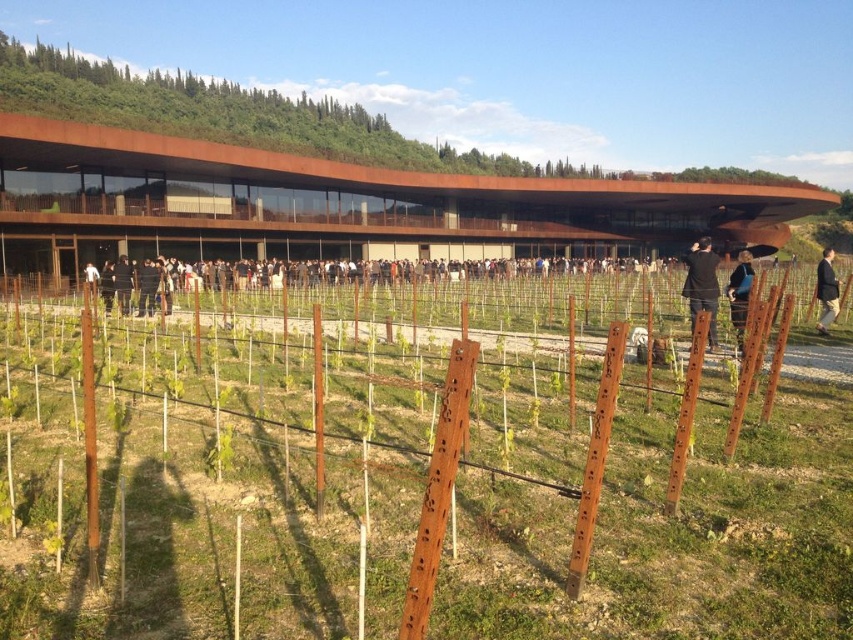
You are a landscape architect designing a new garden. You need to place a large sculpture that requires a space bigger than the rustic wood building at upper center. Can the black fabric at center accommodate it?

The rustic wood building at upper center is larger than the black fabric at center, so the black fabric at center cannot accommodate the sculpture since it is smaller.

You are an architect evaluating the placement of a new sculpture in the vineyard. The sculpture is exactly the same size as the black fabric jacket at lower right. If you want to place the sculpture near the rustic wood building at upper center, will the sculpture fit within the building width?

The rustic wood building at upper center is wider than the black fabric jacket at lower right. Since the sculpture is the same size as the jacket, it will fit within the building width.